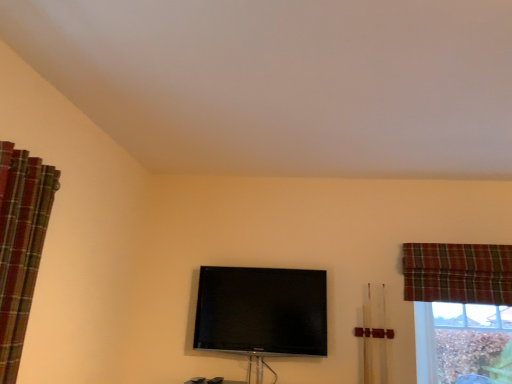
Question: From the image's perspective, is brown textured wood at lower right on plaid fabric curtain at left, the 2th curtain in the back-to-front sequence?

Choices:
 (A) yes
 (B) no

Answer: (B)

Question: Is brown textured wood at lower right outside plaid fabric curtain at left, marked as the 2th curtain in a right-to-left arrangement?

Choices:
 (A) yes
 (B) no

Answer: (A)

Question: Can you confirm if brown textured wood at lower right is positioned to the left of plaid fabric curtain at left, the 2th curtain in the back-to-front sequence?

Choices:
 (A) yes
 (B) no

Answer: (B)

Question: Can you confirm if brown textured wood at lower right is shorter than plaid fabric curtain at left, marked as the 2th curtain in a right-to-left arrangement?

Choices:
 (A) yes
 (B) no

Answer: (A)

Question: Considering the relative sizes of brown textured wood at lower right and plaid fabric curtain at left, acting as the 1th curtain starting from the left, in the image provided, is brown textured wood at lower right bigger than plaid fabric curtain at left, acting as the 1th curtain starting from the left,?

Choices:
 (A) no
 (B) yes

Answer: (A)

Question: Is plaid fabric curtain at upper right, arranged as the 1th curtain when viewed from the back, to the left or to the right of plaid fabric curtain at left, acting as the 1th curtain starting from the front, in the image?

Choices:
 (A) right
 (B) left

Answer: (A)

Question: Considering their positions, is plaid fabric curtain at upper right, placed as the 2th curtain when sorted from front to back, located in front of or behind plaid fabric curtain at left, acting as the 1th curtain starting from the left?

Choices:
 (A) front
 (B) behind

Answer: (B)

Question: Is point (451, 256) closer or farther from the camera than point (26, 269)?

Choices:
 (A) closer
 (B) farther

Answer: (B)

Question: Considering the positions of plaid fabric curtain at upper right, placed as the 2th curtain when sorted from front to back, and plaid fabric curtain at left, the 2th curtain in the back-to-front sequence, in the image, is plaid fabric curtain at upper right, placed as the 2th curtain when sorted from front to back, wider or thinner than plaid fabric curtain at left, the 2th curtain in the back-to-front sequence,?

Choices:
 (A) thin
 (B) wide

Answer: (A)

Question: From the image's perspective, is plaid fabric curtain at upper right, which is counted as the 1th curtain, starting from the right, positioned above or below brown textured wood at lower right?

Choices:
 (A) above
 (B) below

Answer: (A)

Question: Is point (498, 281) closer or farther from the camera than point (471, 339)?

Choices:
 (A) closer
 (B) farther

Answer: (A)

Question: Is plaid fabric curtain at upper right, acting as the second curtain starting from the left, spatially inside brown textured wood at lower right, or outside of it?

Choices:
 (A) outside
 (B) inside

Answer: (A)

Question: In the image, is plaid fabric curtain at upper right, acting as the second curtain starting from the left, positioned in front of or behind brown textured wood at lower right?

Choices:
 (A) behind
 (B) front

Answer: (B)

Question: Considering the positions of brown textured wood at lower right and matte black tv at center in the image, is brown textured wood at lower right taller or shorter than matte black tv at center?

Choices:
 (A) tall
 (B) short

Answer: (A)

Question: From the image's perspective, relative to matte black tv at center, is brown textured wood at lower right above or below?

Choices:
 (A) above
 (B) below

Answer: (A)